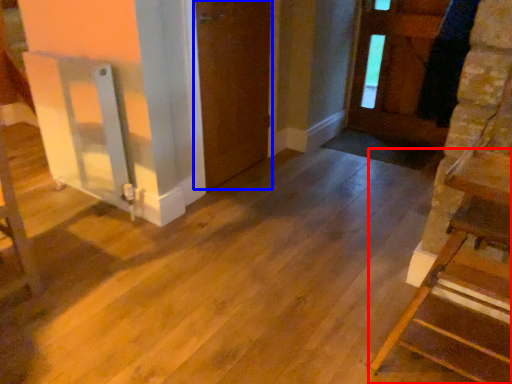
Question: Which point is further to the camera, furniture (highlighted by a red box) or door (highlighted by a blue box)?

Choices:
 (A) furniture
 (B) door

Answer: (B)